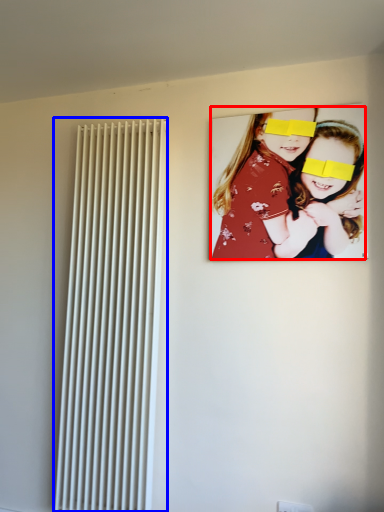
Question: Which object appears closest to the camera in this image, girl (highlighted by a red box) or radiator (highlighted by a blue box)?

Choices:
 (A) girl
 (B) radiator

Answer: (A)